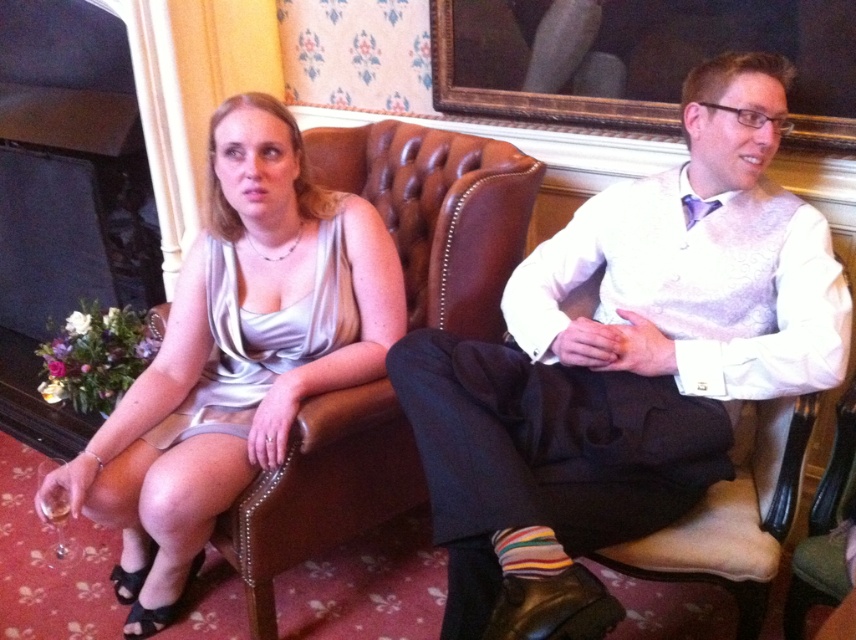
Is the position of wooden framed mirror at upper center less distant than that of striped cotton sock at lower center?

No, wooden framed mirror at upper center is behind striped cotton sock at lower center.

What do you see at coordinates (637, 58) in the screenshot? This screenshot has width=856, height=640. I see `wooden framed mirror at upper center` at bounding box center [637, 58].

Does point (512, 99) lie behind point (500, 532)?

Yes, it is.

The width and height of the screenshot is (856, 640). I want to click on wooden framed mirror at upper center, so click(x=637, y=58).

Consider the image. Can you confirm if white textured shirt at center is shorter than wooden framed mirror at upper center?

No, white textured shirt at center is not shorter than wooden framed mirror at upper center.

Is point (667, 186) positioned in front of point (521, 38)?

That is True.

Locate an element on the screen. The image size is (856, 640). white textured shirt at center is located at coordinates (625, 362).

At what (x,y) coordinates should I click in order to perform the action: click on white textured shirt at center. Please return your answer as a coordinate pair (x, y). This screenshot has height=640, width=856. Looking at the image, I should click on (625, 362).

Is point (845, 84) farther from viewer compared to point (262, 365)?

No, (845, 84) is closer to viewer.

Between wooden framed mirror at upper center and satin dress at left, which one is positioned higher?

wooden framed mirror at upper center is above.

What are the coordinates of `wooden framed mirror at upper center` in the screenshot? It's located at (637, 58).